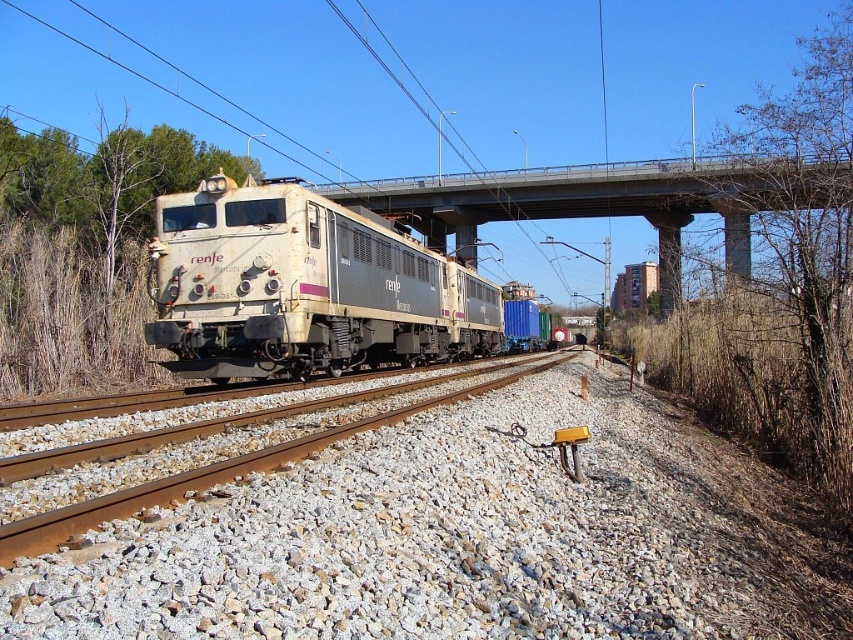
Locate an element on the screen. white matte train at center is located at coordinates (303, 288).

Is point (264, 180) positioned before point (843, 173)?

No, (264, 180) is further to viewer.

The image size is (853, 640). I want to click on white matte train at center, so click(303, 288).